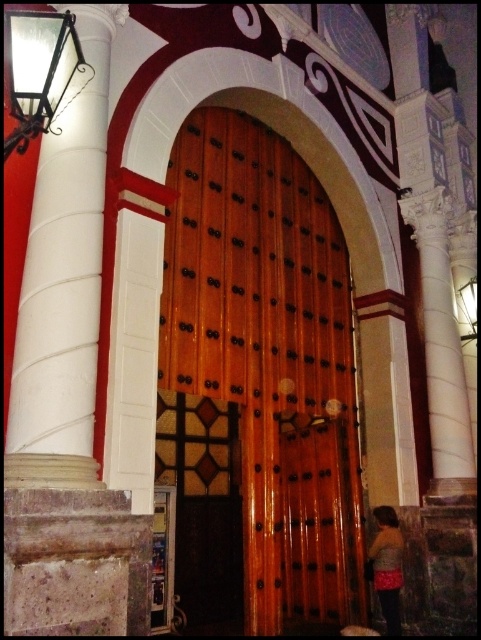
Question: Does wooden door at center appear on the right side of brown textured sweater at lower right?

Choices:
 (A) no
 (B) yes

Answer: (A)

Question: Is wooden door at center wider than metallic black lamp at upper left?

Choices:
 (A) no
 (B) yes

Answer: (B)

Question: Which of the following is the farthest from the observer?

Choices:
 (A) wooden door at center
 (B) white marble column at left
 (C) brown textured sweater at lower right

Answer: (A)

Question: Among these objects, which one is nearest to the camera?

Choices:
 (A) brown textured sweater at lower right
 (B) wooden door at center
 (C) metallic black lamp at upper left

Answer: (C)

Question: Estimate the real-world distances between objects in this image. Which object is closer to the brown textured sweater at lower right?

Choices:
 (A) wooden door at center
 (B) metallic black lamp at upper left

Answer: (A)

Question: Observing the image, what is the correct spatial positioning of white marble column at left in reference to brown textured sweater at lower right?

Choices:
 (A) right
 (B) left

Answer: (B)